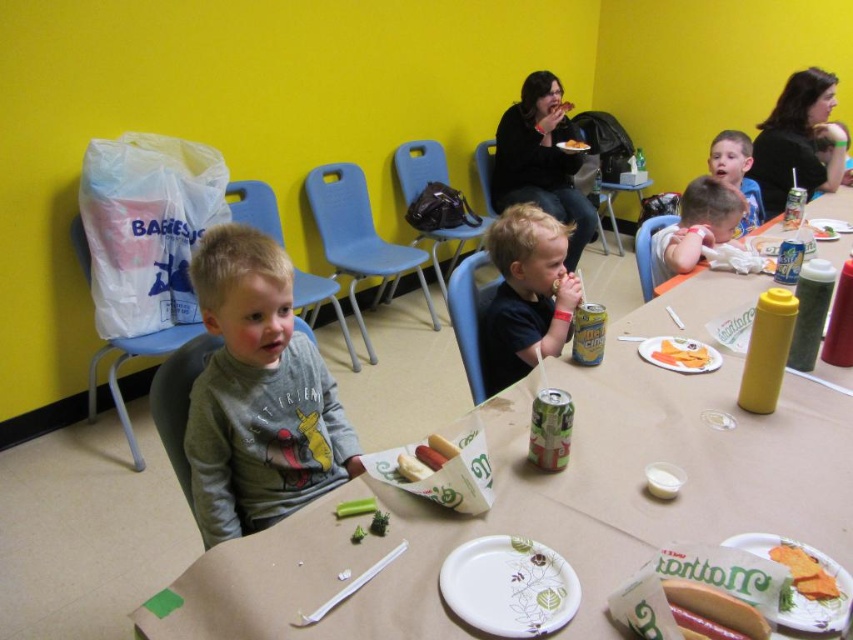
Question: Does matte gray table at center come in front of white paper plate at table center?

Choices:
 (A) no
 (B) yes

Answer: (B)

Question: Which point is farther to the camera?

Choices:
 (A) (840, 224)
 (B) (735, 195)
 (C) (732, 596)

Answer: (A)

Question: Is the position of white paper plate with floral design at table center less distant than that of smooth blue shirt at center?

Choices:
 (A) yes
 (B) no

Answer: (A)

Question: Which point is farther from the camera taking this photo?

Choices:
 (A) (527, 605)
 (B) (750, 141)
 (C) (648, 352)
 (D) (412, 461)

Answer: (B)

Question: Based on their relative distances, which object is farther from the white paper bag at center?

Choices:
 (A) smooth white hot dog at lower right
 (B) white paper plate at table center
 (C) gray cotton shirt at center

Answer: (B)

Question: Does matte black shirt at center have a larger size compared to smooth skin boy at center?

Choices:
 (A) yes
 (B) no

Answer: (A)